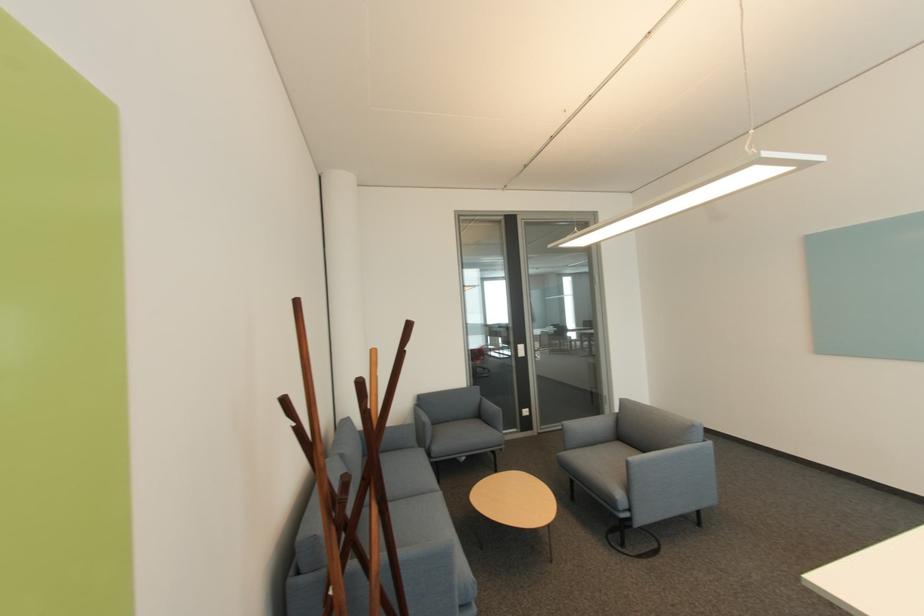
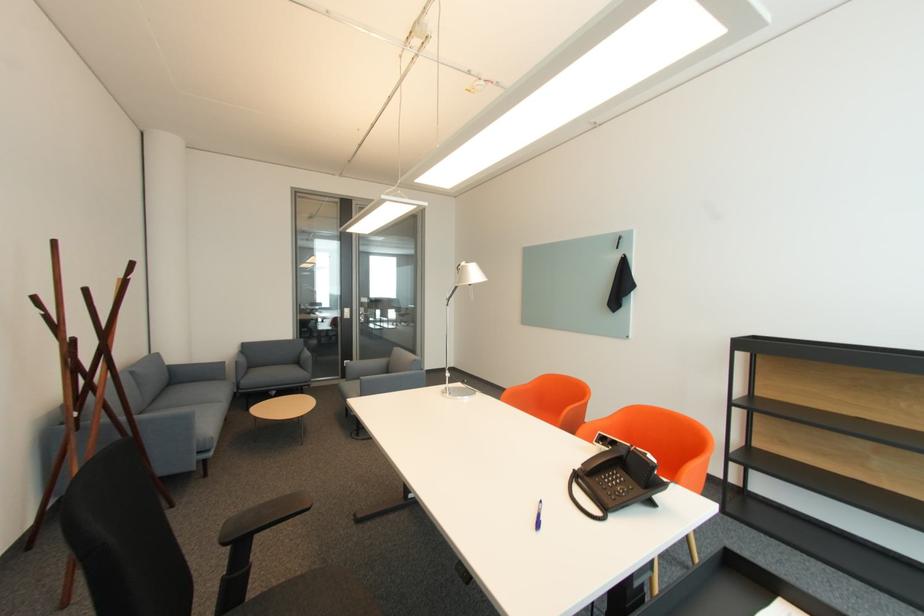
Locate, in the second image, the point that corresponds to (541,358) in the first image.

(367, 320)